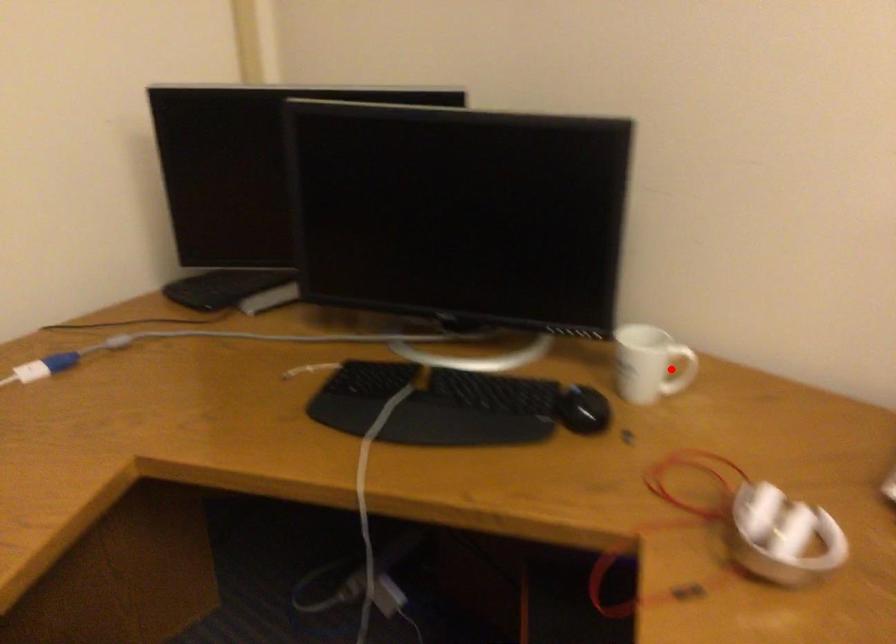
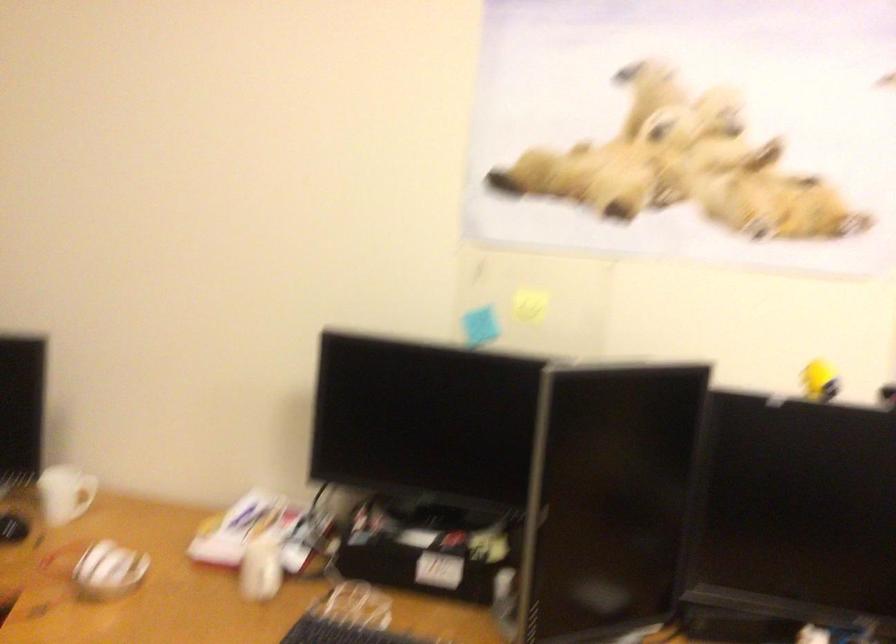
In the second image, find the point that corresponds to the highlighted location in the first image.

(83, 495)